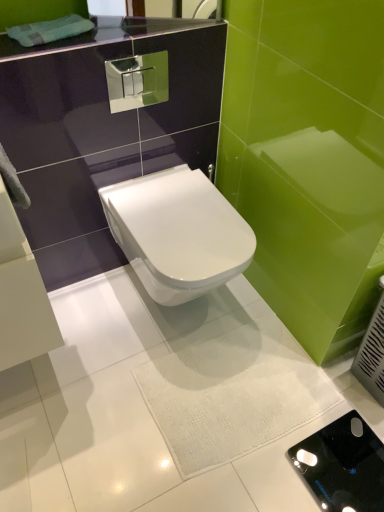
The image size is (384, 512). I want to click on free space above black glossy porcelain at center (from a real-world perspective), so click(354, 461).